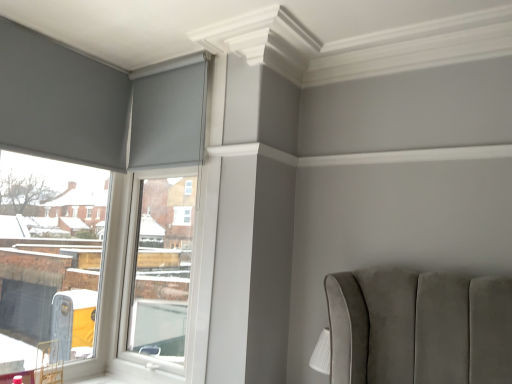
Question: In terms of size, does matte gray curtain at upper left appear bigger or smaller than matte gray roller blind at upper left?

Choices:
 (A) big
 (B) small

Answer: (B)

Question: Looking at their shapes, would you say matte gray curtain at upper left is wider or thinner than matte gray roller blind at upper left?

Choices:
 (A) wide
 (B) thin

Answer: (B)

Question: Estimate the real-world distances between objects in this image. Which object is farther from the matte gray roller blind at upper left?

Choices:
 (A) white plastic window frame at upper left
 (B) matte gray curtain at upper left

Answer: (B)

Question: Estimate the real-world distances between objects in this image. Which object is farther from the white plastic window frame at upper left?

Choices:
 (A) matte gray roller blind at upper left
 (B) matte gray curtain at upper left

Answer: (A)